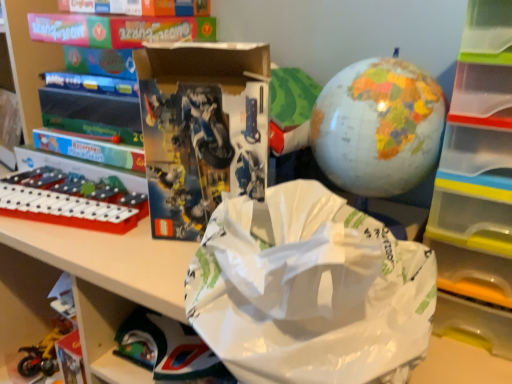
Question: Does white paper grocery bag at center appear on the left side of metallic yellow motorcycle at lower left, arranged as the third toy when viewed from the front?

Choices:
 (A) yes
 (B) no

Answer: (B)

Question: Can you confirm if white paper grocery bag at center is thinner than metallic yellow motorcycle at lower left, acting as the 1th toy starting from the left?

Choices:
 (A) yes
 (B) no

Answer: (B)

Question: Is white paper grocery bag at center next to metallic yellow motorcycle at lower left, the 3th toy in the right-to-left sequence, and touching it?

Choices:
 (A) no
 (B) yes

Answer: (A)

Question: Considering the relative sizes of white paper grocery bag at center and metallic yellow motorcycle at lower left, acting as the 1th toy starting from the left, in the image provided, is white paper grocery bag at center bigger than metallic yellow motorcycle at lower left, acting as the 1th toy starting from the left,?

Choices:
 (A) no
 (B) yes

Answer: (B)

Question: From the image's perspective, would you say white paper grocery bag at center is shown under metallic yellow motorcycle at lower left, acting as the 1th toy starting from the left?

Choices:
 (A) yes
 (B) no

Answer: (B)

Question: Is white paper grocery bag at center taller than metallic yellow motorcycle at lower left, the 3th toy in the right-to-left sequence?

Choices:
 (A) yes
 (B) no

Answer: (A)

Question: Can you confirm if matte black lego set at center is thinner than metallic yellow motorcycle at lower left, the 1th toy when ordered from back to front?

Choices:
 (A) no
 (B) yes

Answer: (B)

Question: Can you confirm if matte black lego set at center is positioned to the left of metallic yellow motorcycle at lower left, the 3th toy in the right-to-left sequence?

Choices:
 (A) yes
 (B) no

Answer: (B)

Question: Is matte black lego set at center bigger than metallic yellow motorcycle at lower left, acting as the 1th toy starting from the left?

Choices:
 (A) no
 (B) yes

Answer: (B)

Question: From the image's perspective, would you say matte black lego set at center is positioned over metallic yellow motorcycle at lower left, the third toy in the top-to-bottom sequence?

Choices:
 (A) yes
 (B) no

Answer: (A)

Question: From the image's perspective, does matte black lego set at center appear lower than metallic yellow motorcycle at lower left, acting as the 1th toy starting from the left?

Choices:
 (A) yes
 (B) no

Answer: (B)

Question: Considering the relative sizes of matte black lego set at center and metallic yellow motorcycle at lower left, the third toy in the top-to-bottom sequence, in the image provided, is matte black lego set at center taller than metallic yellow motorcycle at lower left, the third toy in the top-to-bottom sequence,?

Choices:
 (A) yes
 (B) no

Answer: (A)

Question: Would you say white paper grocery bag at center is outside transparent plastic drawer at right?

Choices:
 (A) yes
 (B) no

Answer: (A)